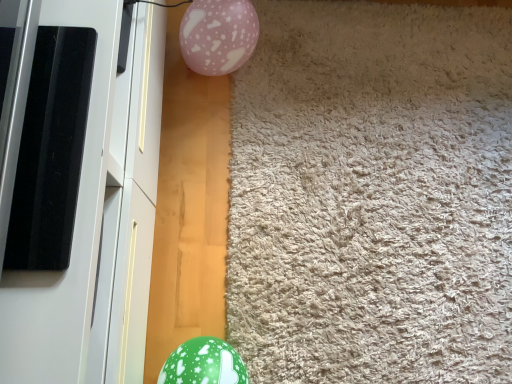
The height and width of the screenshot is (384, 512). In order to click on vacant space underneath beige shaggy carpet at center (from a real-world perspective) in this screenshot , I will do `click(393, 168)`.